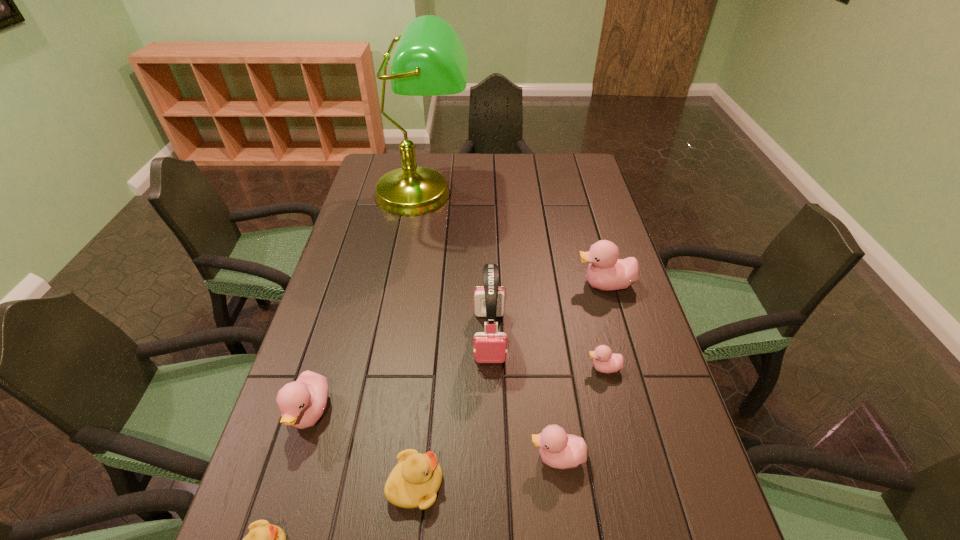
At what (x,y) coordinates should I click in order to perform the action: click on blank space at the far edge of the desktop. Please return your answer as a coordinate pair (x, y). The height and width of the screenshot is (540, 960). Looking at the image, I should click on (522, 183).

In the image, there is a desktop. At what (x,y) coordinates should I click in order to perform the action: click on vacant region at the left edge. Please return your answer as a coordinate pair (x, y). The width and height of the screenshot is (960, 540). Looking at the image, I should click on (331, 394).

In the image, there is a desktop. At what (x,y) coordinates should I click in order to perform the action: click on free region at the right edge. Please return your answer as a coordinate pair (x, y). Looking at the image, I should click on (612, 408).

Identify the location of blank region between the second farthest duckling and the fourth duckling from right to left. Image resolution: width=960 pixels, height=540 pixels. (510, 426).

Locate an element on the screen. Image resolution: width=960 pixels, height=540 pixels. free space between the sixth shortest object and the third duckling from right to left is located at coordinates (581, 371).

The image size is (960, 540). Find the location of `free space between the second farthest duckling and the sixth object from left to right`. free space between the second farthest duckling and the sixth object from left to right is located at coordinates (581, 413).

This screenshot has width=960, height=540. In order to click on unoccupied position between the farthest duckling and the fifth shortest duckling in this screenshot , I will do `click(457, 349)`.

This screenshot has width=960, height=540. In order to click on free space between the leftmost pink duckling and the third object from right to left in this screenshot , I will do `click(434, 435)`.

Where is `free space that is in between the pink earphone and the second biggest pink duckling`? This screenshot has width=960, height=540. free space that is in between the pink earphone and the second biggest pink duckling is located at coordinates (400, 374).

Where is `free space between the fifth shortest duckling and the sixth object from left to right`? free space between the fifth shortest duckling and the sixth object from left to right is located at coordinates (434, 435).